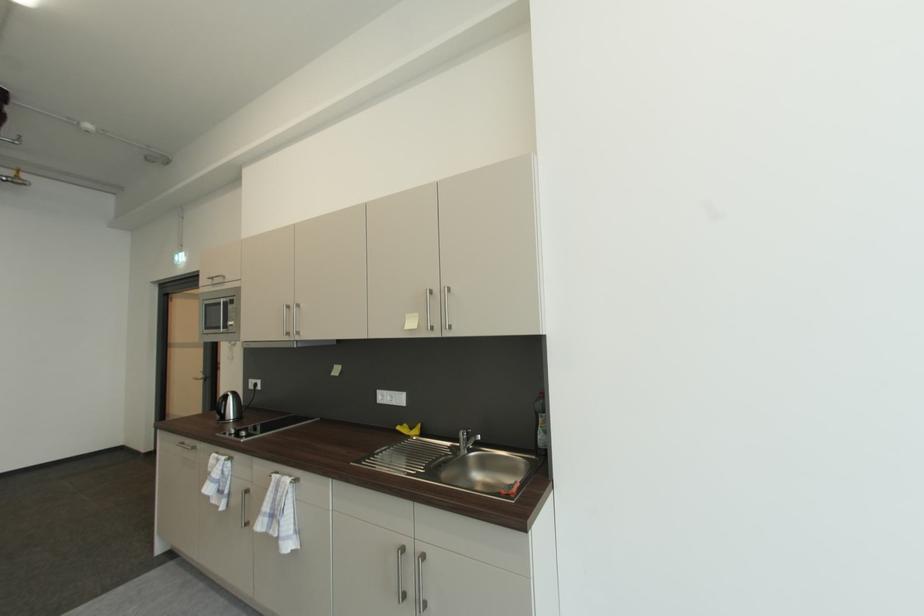
Find where to lift the black electric kettle. Please return your answer as a coordinate pair (x, y).

(228, 407)